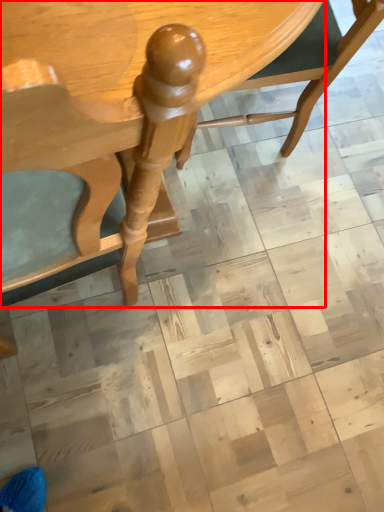
Question: In this image, where is table (annotated by the red box) located relative to chair?

Choices:
 (A) right
 (B) left

Answer: (B)